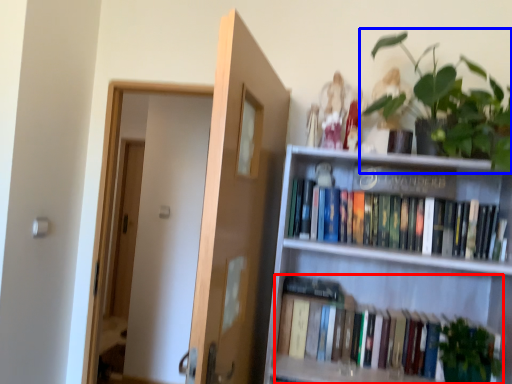
Question: Among these objects, which one is farthest to the camera, book (highlighted by a red box) or houseplant (highlighted by a blue box)?

Choices:
 (A) book
 (B) houseplant

Answer: (A)